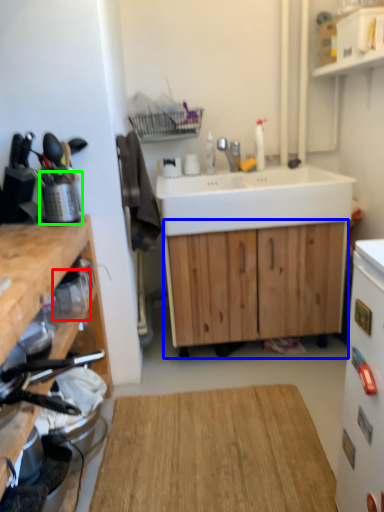
Question: Considering the real-world distances, which object is farthest from appliance (highlighted by a red box)? cabinetry (highlighted by a blue box) or appliance (highlighted by a green box)?

Choices:
 (A) cabinetry
 (B) appliance

Answer: (A)